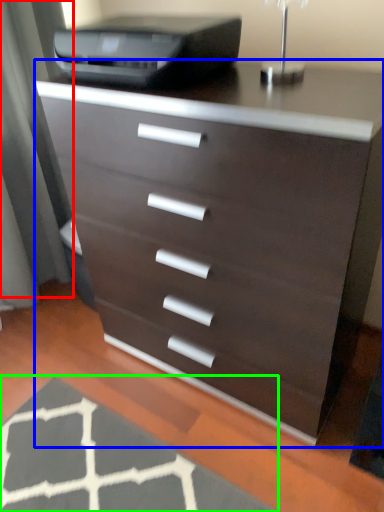
Question: Based on their relative distances, which object is farther from screen door (highlighted by a red box)? Choose from chest of drawers (highlighted by a blue box) and doormat (highlighted by a green box).

Choices:
 (A) chest of drawers
 (B) doormat

Answer: (B)